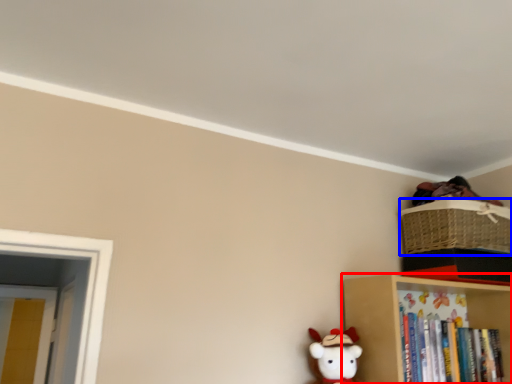
Question: Which object appears farthest to the camera in this image, shelf (highlighted by a red box) or basket (highlighted by a blue box)?

Choices:
 (A) shelf
 (B) basket

Answer: (B)